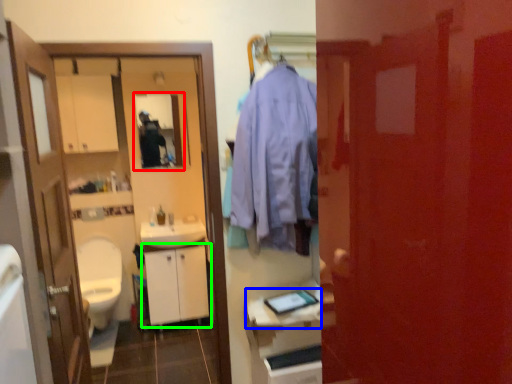
Question: Estimate the real-world distances between objects in this image. Which object is farther from mirror (highlighted by a red box), counter top (highlighted by a blue box) or cabinetry (highlighted by a green box)?

Choices:
 (A) counter top
 (B) cabinetry

Answer: (A)